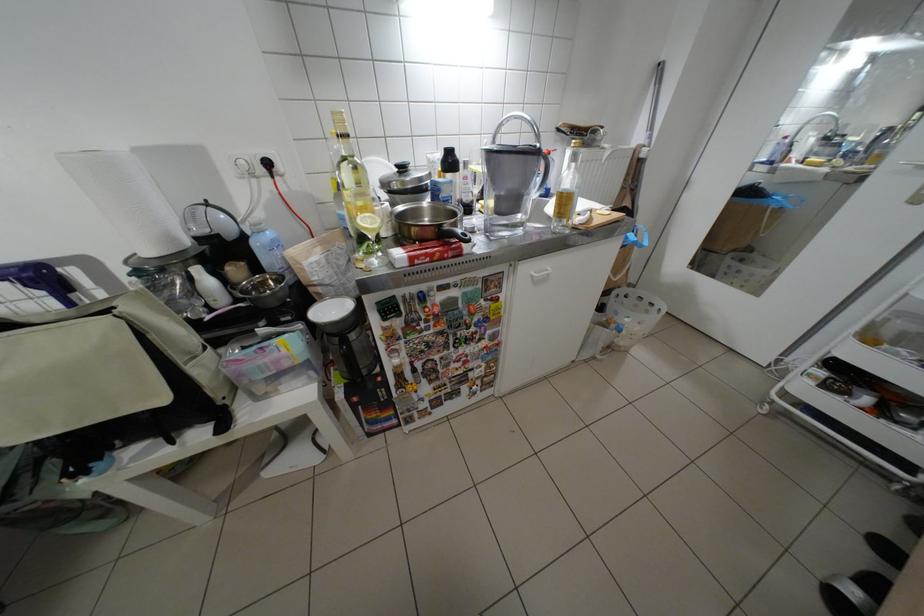
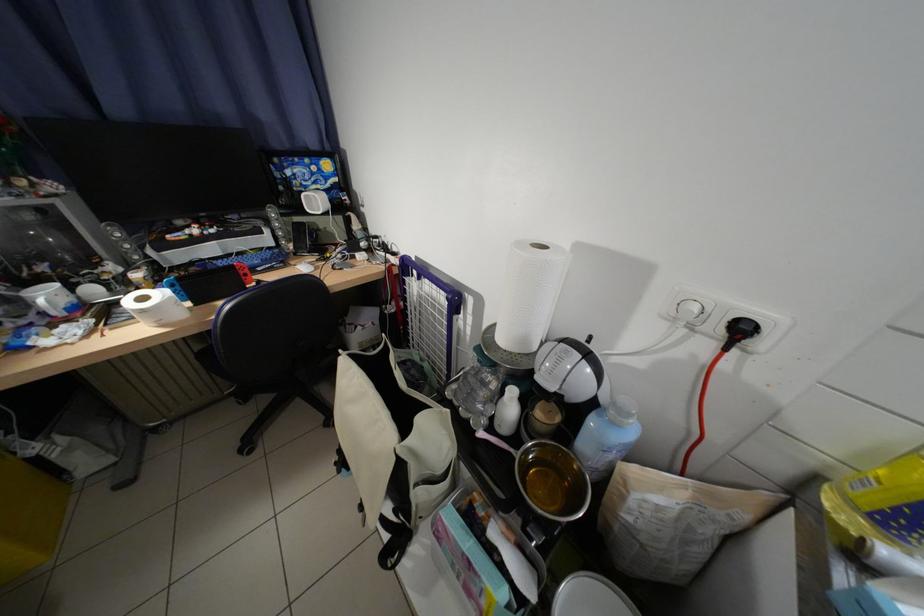
The point at (290, 169) is marked in the first image. Where is the corresponding point in the second image?

(772, 345)